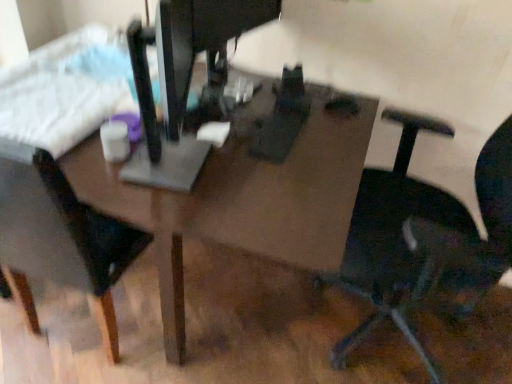
Question: Is black plastic chair at right, which is the 1th chair from right to left, not near matte brown table at center?

Choices:
 (A) no
 (B) yes

Answer: (A)

Question: From the image's perspective, is black plastic chair at right, which is the 1th chair from right to left, located beneath matte brown table at center?

Choices:
 (A) yes
 (B) no

Answer: (A)

Question: Is black plastic chair at right, which is the 1th chair from right to left, aimed at matte brown table at center?

Choices:
 (A) yes
 (B) no

Answer: (A)

Question: Is black plastic chair at right, which is the 1th chair from right to left, positioned with its back to matte brown table at center?

Choices:
 (A) yes
 (B) no

Answer: (B)

Question: Is black plastic chair at right, positioned as the second chair in left-to-right order, outside matte brown table at center?

Choices:
 (A) no
 (B) yes

Answer: (B)

Question: In terms of size, does metallic gray sewing machine at center appear bigger or smaller than black matte chair at left, marked as the 2th chair in a right-to-left arrangement?

Choices:
 (A) small
 (B) big

Answer: (A)

Question: From the image's perspective, is metallic gray sewing machine at center above or below black matte chair at left, the first chair viewed from the left?

Choices:
 (A) above
 (B) below

Answer: (A)

Question: Is metallic gray sewing machine at center in front of or behind black matte chair at left, marked as the 2th chair in a right-to-left arrangement, in the image?

Choices:
 (A) front
 (B) behind

Answer: (A)

Question: In terms of height, does metallic gray sewing machine at center look taller or shorter compared to black matte chair at left, the first chair viewed from the left?

Choices:
 (A) tall
 (B) short

Answer: (B)

Question: In terms of width, does black plastic chair at right, positioned as the second chair in left-to-right order, look wider or thinner when compared to black matte chair at left, the first chair viewed from the left?

Choices:
 (A) wide
 (B) thin

Answer: (A)

Question: From a real-world perspective, relative to black matte chair at left, the first chair viewed from the left, is black plastic chair at right, positioned as the second chair in left-to-right order, vertically above or below?

Choices:
 (A) below
 (B) above

Answer: (B)

Question: From the image's perspective, is black plastic chair at right, positioned as the second chair in left-to-right order, above or below black matte chair at left, marked as the 2th chair in a right-to-left arrangement?

Choices:
 (A) above
 (B) below

Answer: (B)

Question: Does point (393, 284) appear closer or farther from the camera than point (34, 225)?

Choices:
 (A) closer
 (B) farther

Answer: (A)

Question: Does point (51, 278) appear closer or farther from the camera than point (189, 198)?

Choices:
 (A) closer
 (B) farther

Answer: (B)

Question: Considering their positions, is black matte chair at left, marked as the 2th chair in a right-to-left arrangement, located in front of or behind matte brown table at center?

Choices:
 (A) front
 (B) behind

Answer: (A)